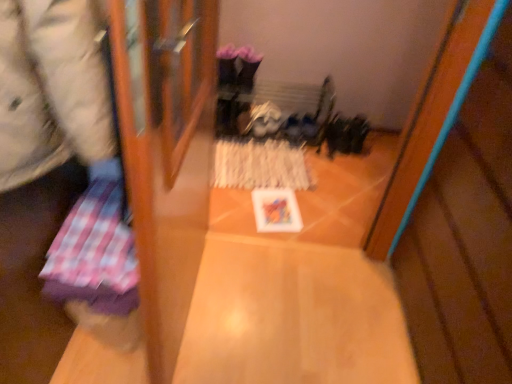
Question: Considering the positions of point (308, 177) and point (362, 367), is point (308, 177) closer or farther from the camera than point (362, 367)?

Choices:
 (A) closer
 (B) farther

Answer: (B)

Question: Considering their positions, is white textured paper at center, the 2th wrapping paper from the front, located in front of or behind wooden table at center?

Choices:
 (A) behind
 (B) front

Answer: (A)

Question: Which of these objects is positioned closest to the white textured paper at center, positioned as the first wrapping paper in back-to-front order?

Choices:
 (A) wooden table at center
 (B) plaid fabric at left, the second wrapping paper from the back
 (C) wooden floor at lower right
 (D) plaid fabric at left

Answer: (A)

Question: Which is farther from the plaid fabric at left, placed as the second wrapping paper when sorted from top to bottom?

Choices:
 (A) white textured paper at center, the 1th wrapping paper viewed from the right
 (B) wooden floor at lower right
 (C) plaid fabric at left
 (D) wooden table at center

Answer: (A)